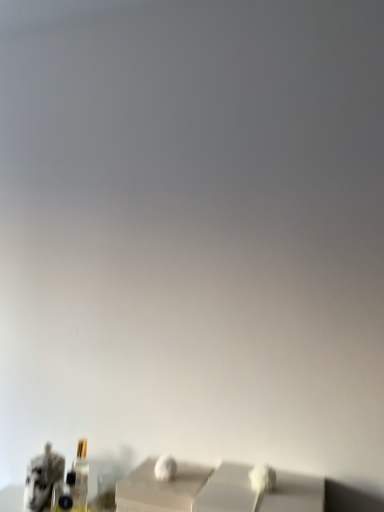
Question: Is point (84, 467) closer or farther from the camera than point (54, 472)?

Choices:
 (A) closer
 (B) farther

Answer: (B)

Question: Visually, is matte gold bottle at lower left positioned to the left or to the right of camouflage-patterned figurine at lower left?

Choices:
 (A) right
 (B) left

Answer: (A)

Question: Considering the positions of matte gold bottle at lower left and camouflage-patterned figurine at lower left in the image, is matte gold bottle at lower left taller or shorter than camouflage-patterned figurine at lower left?

Choices:
 (A) tall
 (B) short

Answer: (A)

Question: Considering the positions of point (54, 461) and point (77, 467), is point (54, 461) closer or farther from the camera than point (77, 467)?

Choices:
 (A) closer
 (B) farther

Answer: (A)

Question: Is camouflage-patterned figurine at lower left taller or shorter than matte gold bottle at lower left?

Choices:
 (A) tall
 (B) short

Answer: (B)

Question: Considering the positions of camouflage-patterned figurine at lower left and matte gold bottle at lower left in the image, is camouflage-patterned figurine at lower left bigger or smaller than matte gold bottle at lower left?

Choices:
 (A) big
 (B) small

Answer: (A)

Question: Is camouflage-patterned figurine at lower left wider or thinner than matte gold bottle at lower left?

Choices:
 (A) wide
 (B) thin

Answer: (A)